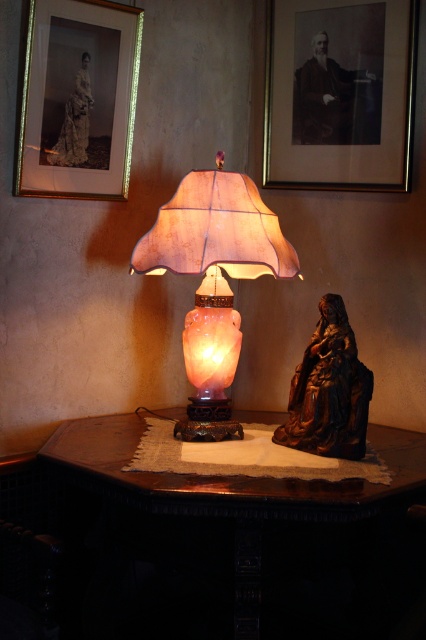
From the picture: You are a delivery person who needs to place a package on the wooden table at center. The package is as tall as the bronze statue at right. Will the package fit on the table without exceeding its height?

The wooden table at center is taller than the bronze statue at right, so the package, which is as tall as the bronze statue at right, will fit on the table without exceeding its height.